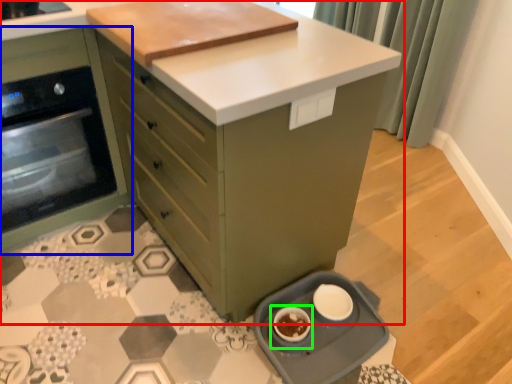
Question: Based on their relative distances, which object is nearer to cabinetry (highlighted by a red box)? Choose from cabinetry (highlighted by a blue box) and appliance (highlighted by a green box).

Choices:
 (A) cabinetry
 (B) appliance

Answer: (A)